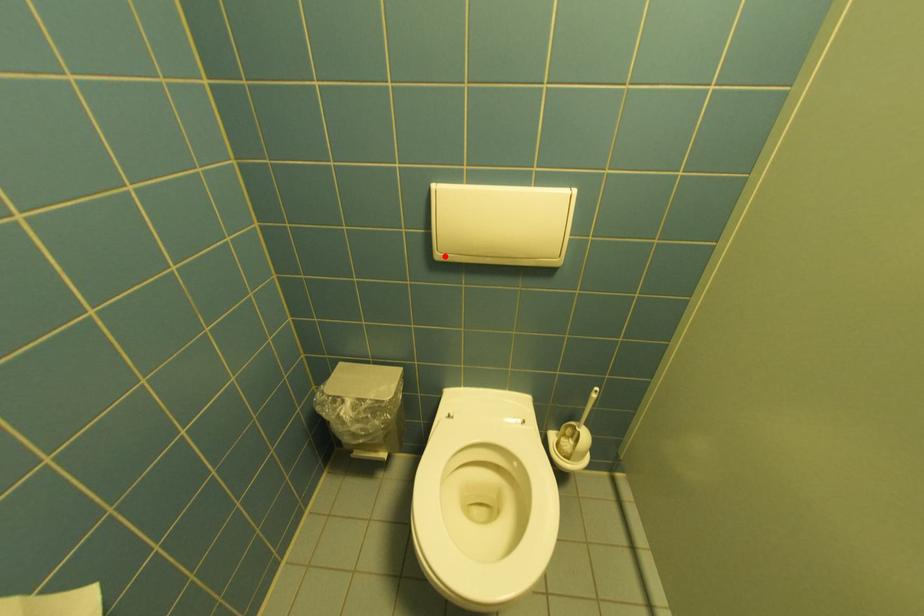
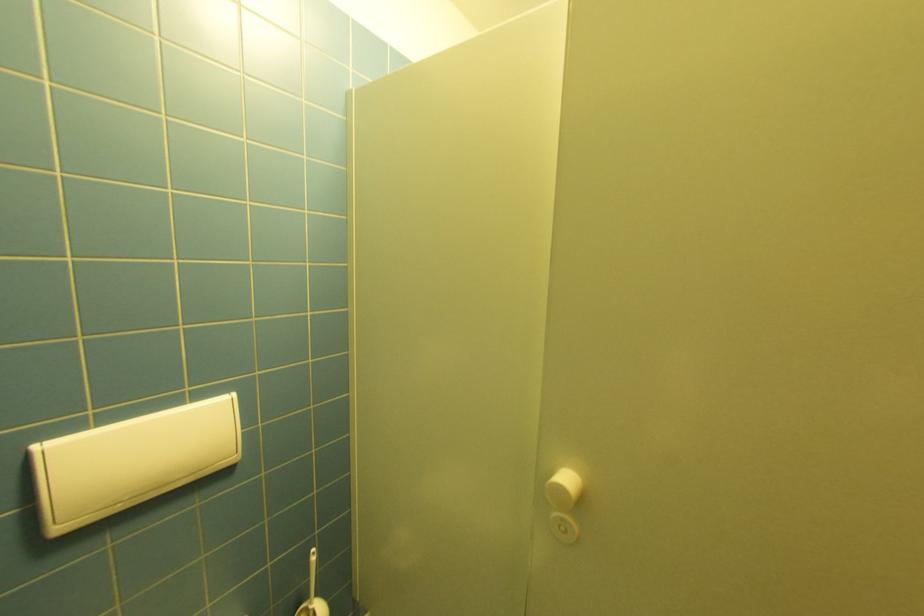
Question: I am providing you with two images of the same scene from different viewpoints. A red point is shown in image1. For the corresponding object point in image2, is it positioned nearer or farther from the camera?

Choices:
 (A) Nearer
 (B) Farther

Answer: (A)